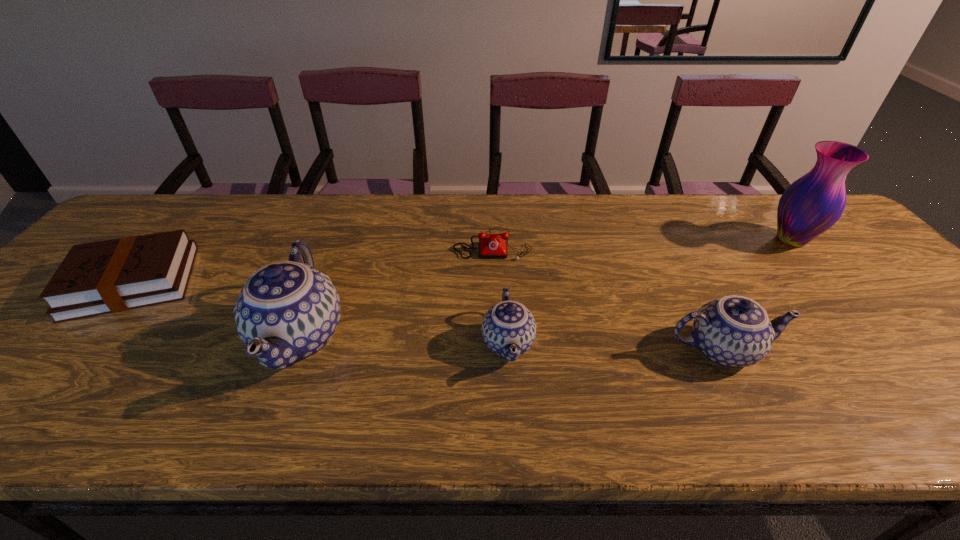
Given the evenly spaced chinawares in the image, where should an extra chinaware be added on the right to preserve the spacing? Please point to a vacant space. Please provide its 2D coordinates. Your answer should be formatted as a tuple, i.e. [(x, y)], where the tuple contains the x and y coordinates of a point satisfying the conditions above.

[(943, 356)]